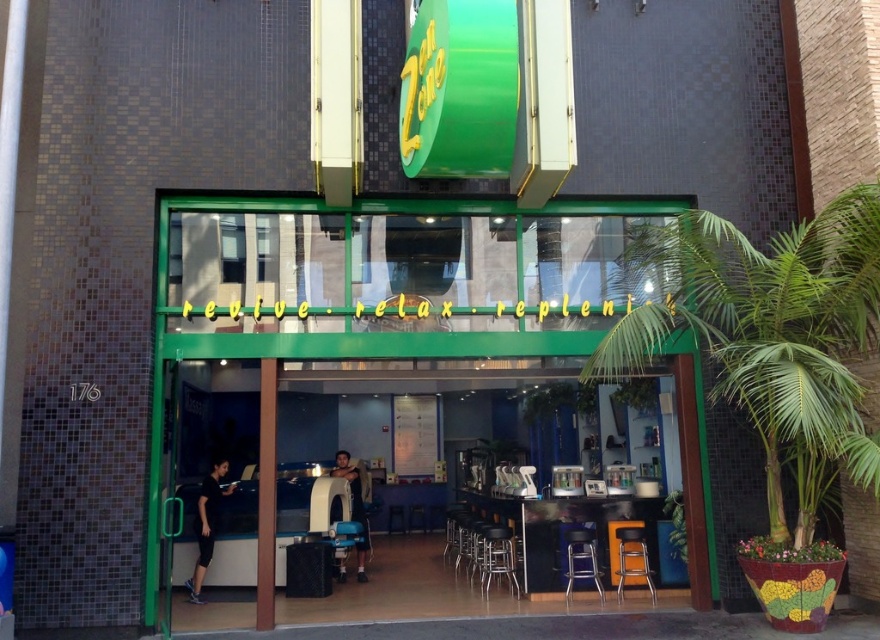
You are standing at the entrance of the Zen Zone storefront and see two points marked on the glass facade. The first point is at coordinates point (x=521, y=577) and the second is at point (x=229, y=465). Which point is closer to you as you face the storefront?

Point (x=521, y=577) is in front of point (x=229, y=465), so it is closer to you as you face the storefront.

You are a customer wanting to enter the Zen Zone spa. You see the black plastic door at center and the metallic gold bar stool at lower center. Which object is larger in size?

The black plastic door at center is bigger than the metallic gold bar stool at lower center.

You are standing at the camera position and want to place a 1.5 meter long object on the black glossy table at center. Is there enough space on the table to fit the object?

The black glossy table at center and camera are 7.92 meters apart. Since the object is only 1.5 meters long, there should be sufficient space on the table to accommodate it, as the distance between the camera and the table does not directly affect the table length. However, without knowing the table dimensions, we can only confirm the distance between the two points.